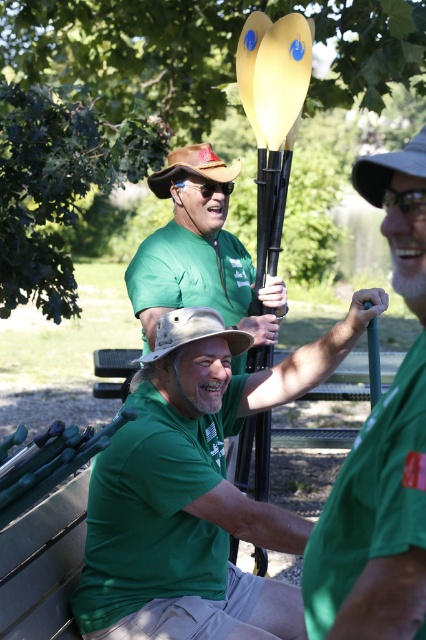
How distant is green matte kayak paddle at center from green matte kayak paddle at right?

A distance of 3.64 feet exists between green matte kayak paddle at center and green matte kayak paddle at right.

Who is positioned more to the right, green matte kayak paddle at center or green matte kayak paddle at right?

Positioned to the right is green matte kayak paddle at right.

I want to click on green matte kayak paddle at center, so click(195, 486).